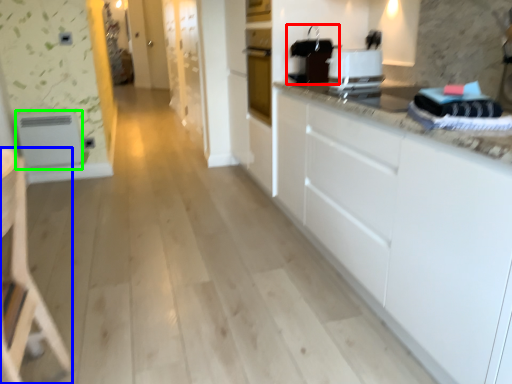
Question: Which is farther away from appliance (highlighted by a red box)? armchair (highlighted by a blue box) or appliance (highlighted by a green box)?

Choices:
 (A) armchair
 (B) appliance

Answer: (B)